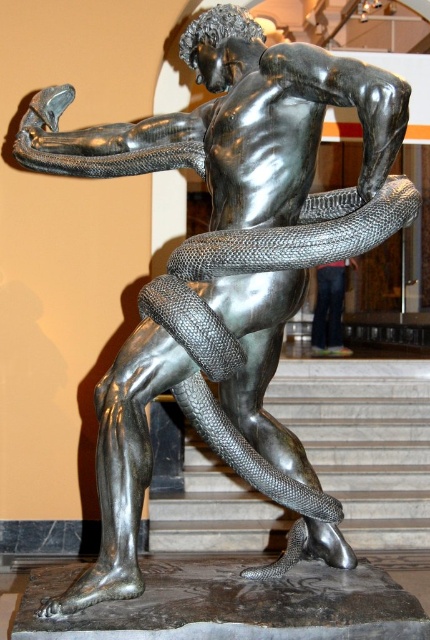
Who is taller, shiny metallic snake at center or shiny silver pants at center?

shiny metallic snake at center

Who is positioned more to the left, shiny metallic snake at center or shiny silver pants at center?

shiny metallic snake at center

This screenshot has width=430, height=640. In order to click on shiny metallic snake at center in this screenshot , I will do `click(267, 262)`.

Where is `shiny metallic snake at center`? shiny metallic snake at center is located at coordinates (267, 262).